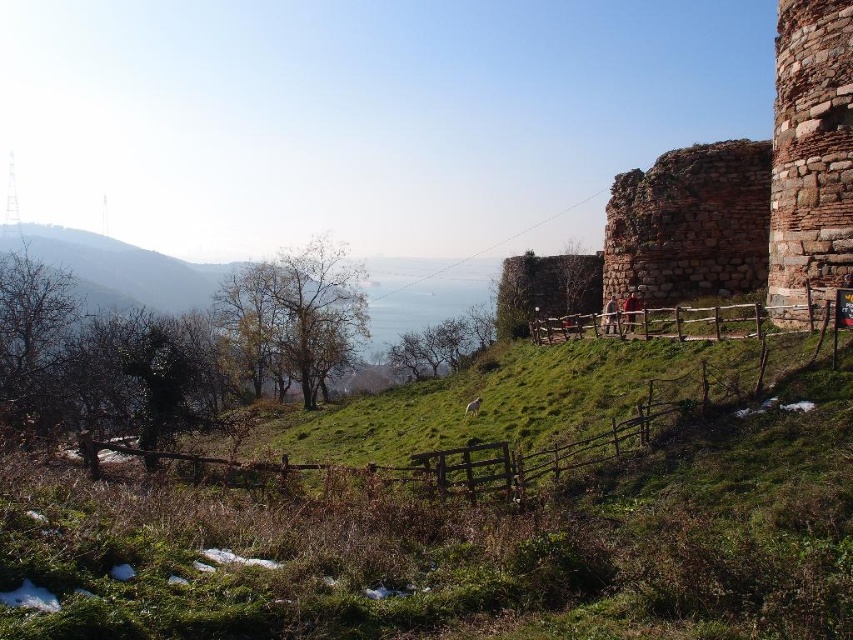
Question: Among these objects, which one is farthest from the camera?

Choices:
 (A) green grassy at center
 (B) rustic stone wall at upper right

Answer: (B)

Question: Can you confirm if green grassy at center is smaller than rustic stone wall at upper right?

Choices:
 (A) yes
 (B) no

Answer: (A)

Question: Does green grassy at center appear on the right side of rustic stone wall at upper right?

Choices:
 (A) no
 (B) yes

Answer: (A)

Question: Among these objects, which one is farthest from the camera?

Choices:
 (A) rustic stone wall at upper right
 (B) green grassy at center

Answer: (A)

Question: Is green grassy at center below rustic stone wall at upper right?

Choices:
 (A) yes
 (B) no

Answer: (A)